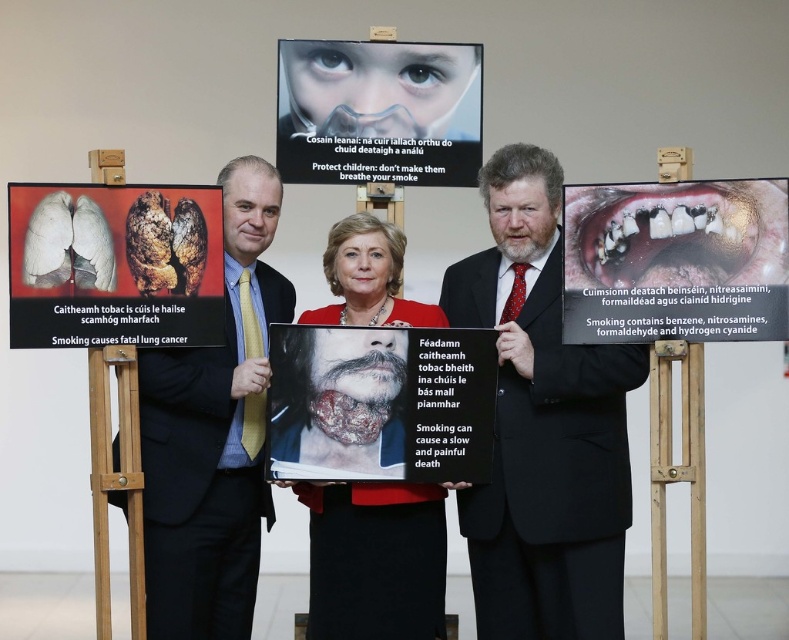
Question: Which object appears closest to the camera in this image?

Choices:
 (A) scarred skin poster at center
 (B) black suit at center
 (C) smooth skin face at center
 (D) yellowish dentin tooth at center

Answer: (D)

Question: Can you confirm if yellow tie at center is wider than matte plastic mask at upper center?

Choices:
 (A) yes
 (B) no

Answer: (B)

Question: Is smooth skin face at center further to the viewer compared to matte plastic mask at upper center?

Choices:
 (A) yes
 (B) no

Answer: (B)

Question: Which of the following is the farthest from the observer?

Choices:
 (A) (537, 432)
 (B) (49, 300)

Answer: (A)

Question: Among these points, which one is farthest from the camera?

Choices:
 (A) (533, 161)
 (B) (294, 77)
 (C) (262, 234)

Answer: (B)

Question: Can you confirm if scarred skin poster at center is thinner than smooth skin face at center?

Choices:
 (A) yes
 (B) no

Answer: (B)